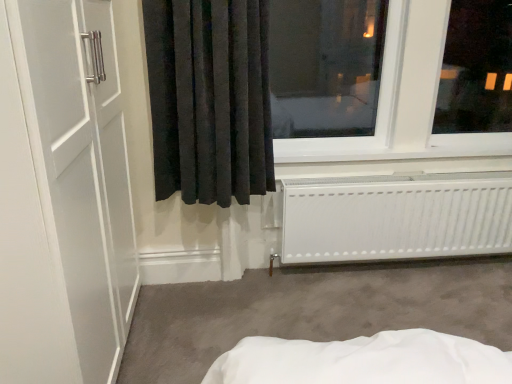
Question: From a real-world perspective, is black velvet curtain at center located beneath transparent glass window at upper right?

Choices:
 (A) yes
 (B) no

Answer: (A)

Question: From the image's perspective, is black velvet curtain at center on transparent glass window at upper right?

Choices:
 (A) yes
 (B) no

Answer: (B)

Question: Could you tell me if black velvet curtain at center is facing transparent glass window at upper right?

Choices:
 (A) yes
 (B) no

Answer: (B)

Question: Considering the relative sizes of black velvet curtain at center and transparent glass window at upper right in the image provided, is black velvet curtain at center bigger than transparent glass window at upper right?

Choices:
 (A) yes
 (B) no

Answer: (B)

Question: Are black velvet curtain at center and transparent glass window at upper right making contact?

Choices:
 (A) no
 (B) yes

Answer: (A)

Question: Is black velvet curtain at center smaller than transparent glass window at upper right?

Choices:
 (A) yes
 (B) no

Answer: (A)

Question: Would you say transparent glass window at upper right contains white matte radiator at lower right?

Choices:
 (A) no
 (B) yes

Answer: (A)

Question: Is transparent glass window at upper right completely or partially outside of white matte radiator at lower right?

Choices:
 (A) no
 (B) yes

Answer: (B)

Question: Is the surface of transparent glass window at upper right in direct contact with white matte radiator at lower right?

Choices:
 (A) no
 (B) yes

Answer: (A)

Question: Is transparent glass window at upper right facing away from white matte radiator at lower right?

Choices:
 (A) no
 (B) yes

Answer: (A)

Question: From the image's perspective, is transparent glass window at upper right under white matte radiator at lower right?

Choices:
 (A) no
 (B) yes

Answer: (A)

Question: Does transparent glass window at upper right have a greater width compared to white matte radiator at lower right?

Choices:
 (A) yes
 (B) no

Answer: (A)

Question: Considering the relative positions of white matte radiator at lower right and black velvet curtain at center in the image provided, is white matte radiator at lower right behind black velvet curtain at center?

Choices:
 (A) no
 (B) yes

Answer: (B)